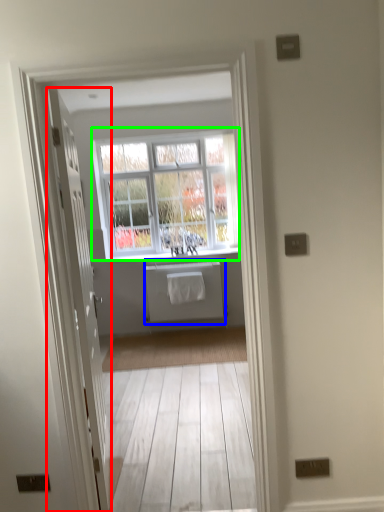
Question: Which object is positioned farthest from door (highlighted by a red box)? Select from appliance (highlighted by a blue box) and window (highlighted by a green box).

Choices:
 (A) appliance
 (B) window

Answer: (B)